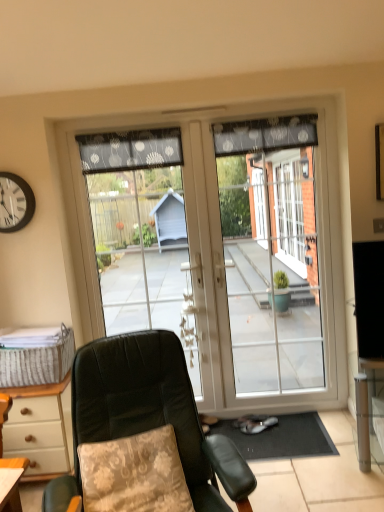
You are a GUI agent. You are given a task and a screenshot of the screen. Output one action in this format:
    pyautogui.click(x=<x>, y=<y>)
    Task: Click on the vacant point above dark gray dotted fabric at upper center, which ranks as the first curtain in left-to-right order (from a real-world perspective)
    The image size is (384, 512).
    Given the screenshot: What is the action you would take?
    pyautogui.click(x=116, y=124)